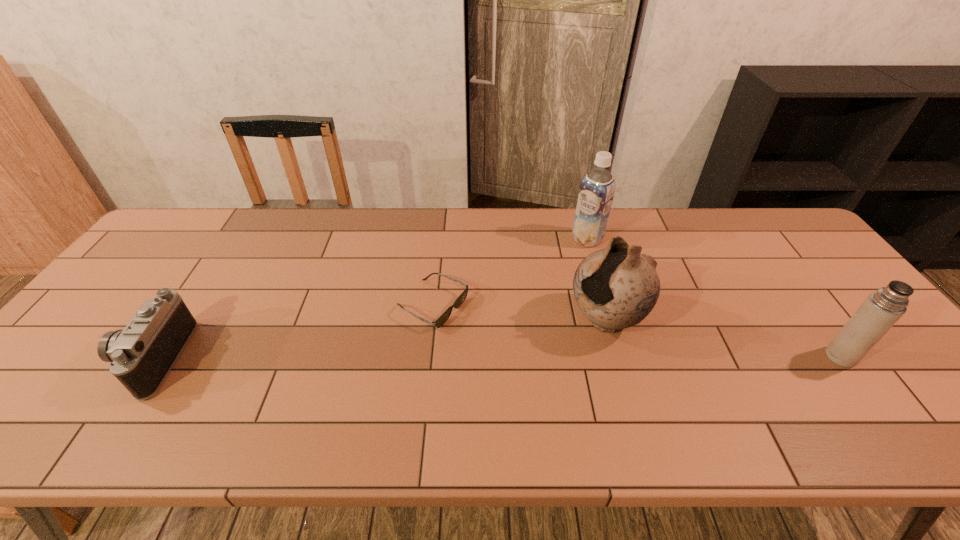
Where is `free space on the desktop that is between the camera and the thermos bottle and is positioned on the front-facing side of the fourth object from right to left`? free space on the desktop that is between the camera and the thermos bottle and is positioned on the front-facing side of the fourth object from right to left is located at coordinates (541, 357).

I want to click on free space on the desktop that is between the leftmost object and the rightmost object and is positioned from the spout of the pottery, so click(547, 357).

This screenshot has height=540, width=960. I want to click on vacant space on the desktop that is between the fourth tallest object and the third tallest object and is positioned on the label of the farthest object, so click(447, 358).